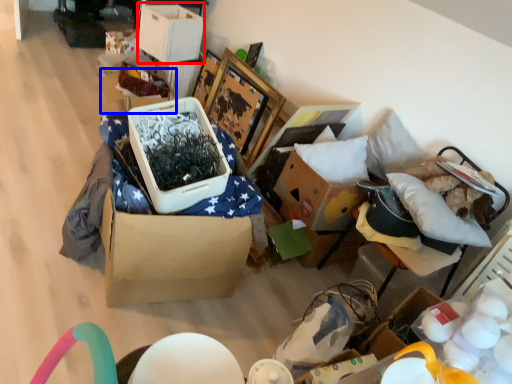
Question: Which of the following is the closest to the observer, storage box (highlighted by a red box) or storage box (highlighted by a blue box)?

Choices:
 (A) storage box
 (B) storage box

Answer: (A)